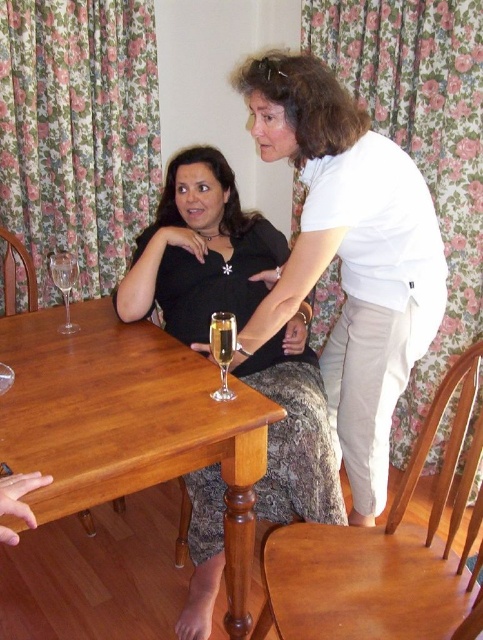
What is located at the coordinates point (199,250) in the image?

At point (199,250) lies the black matte dress at center.

You are a photographer trying to capture a candid shot of the two women at the dining table. You notice two specific points in the scene at coordinates point (x=271, y=339) and point (x=228, y=321). Which of these points is closer to the camera lens?

Point (x=271, y=339) is further to the viewer than point (x=228, y=321), so the point closer to the camera lens would be point (x=228, y=321).

You are hosting a dinner party and need to ensure there is enough space between the black matte dress at center and the clear glass wine glass at table left for guests to comfortably pass by. Based on their sizes, can you confirm if there is sufficient space?

The black matte dress at center is wider than the clear glass wine glass at table left. However, the description only provides information about their widths, not the distance between them. Therefore, it is unclear if there is enough space for guests to pass comfortably without additional details about their positioning.